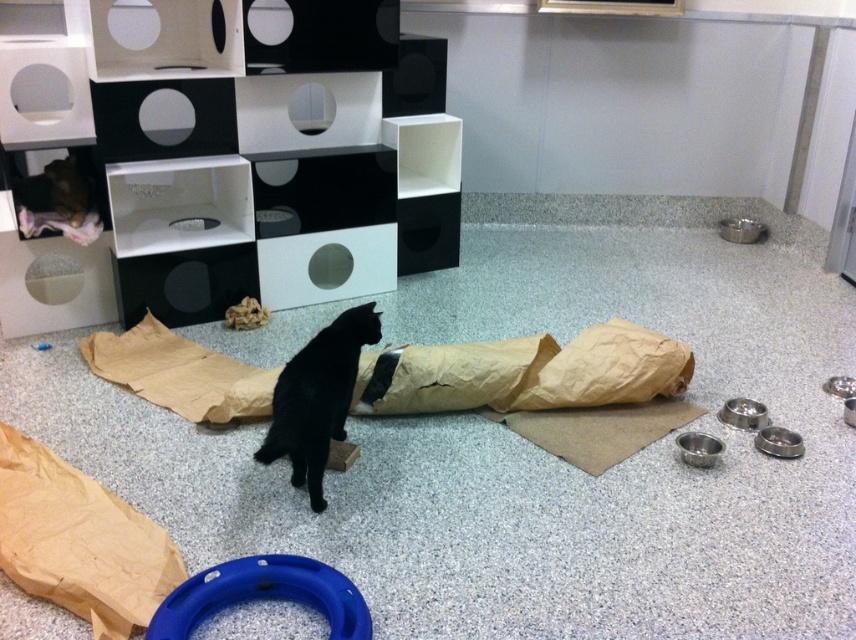
You are a cat owner who wants to ensure your cat can reach its favorite toy, the blue rubber ring at lower center, from its current position on the black matte fur cat at center. Given that your cat can jump 16 inches vertically, will it be able to reach the toy?

The distance between the black matte fur cat at center and the blue rubber ring at lower center is 17.30 inches. Since the cat can only jump 16 inches vertically, it will not be able to reach the toy.

You are a cat in the room. You want to play with the blue rubber ring at lower center but first need to step over the brown crinkled paper bag at lower left. Can you do it?

The brown crinkled paper bag at lower left is further to the viewer than blue rubber ring at lower center, so the cat can step over the brown crinkled paper bag at lower left to reach the blue rubber ring at lower center.